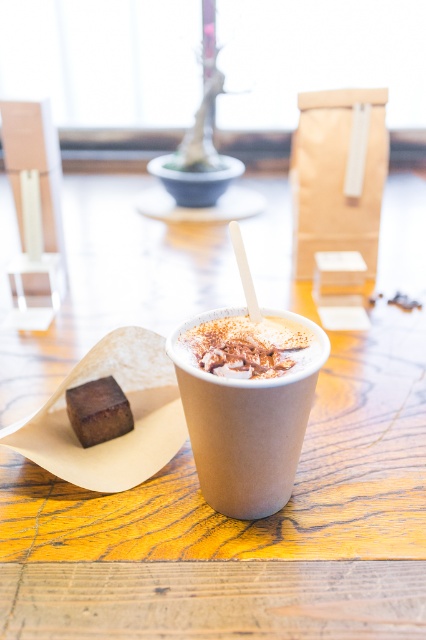
Question: Which of the following is the farthest from the observer?

Choices:
 (A) (224, 243)
 (B) (114, 403)
 (C) (276, 492)

Answer: (A)

Question: Can you confirm if brown paper cup at center is thinner than dark brown cake at lower left?

Choices:
 (A) yes
 (B) no

Answer: (B)

Question: Which is nearer to the dark brown cake at lower left?

Choices:
 (A) brown paper cup at center
 (B) wooden table at center
 (C) creme matte coffee cup at center

Answer: (A)

Question: Among these points, which one is nearest to the camera?

Choices:
 (A) (221, 333)
 (B) (408, 184)
 (C) (97, 432)
 (D) (247, 396)

Answer: (D)

Question: Is wooden table at center to the left of brown paper cup at center from the viewer's perspective?

Choices:
 (A) yes
 (B) no

Answer: (A)

Question: Can you confirm if wooden table at center is bigger than creme matte coffee cup at center?

Choices:
 (A) yes
 (B) no

Answer: (A)